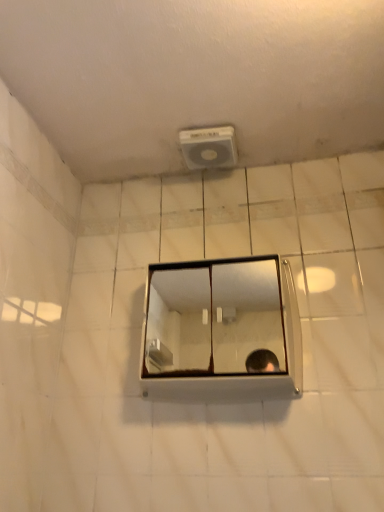
Find the location of a particular element. This screenshot has width=384, height=512. metallic rectangular mirror at center is located at coordinates (214, 319).

Describe the element at coordinates (214, 319) in the screenshot. Image resolution: width=384 pixels, height=512 pixels. I see `metallic rectangular mirror at center` at that location.

Locate an element on the screen. The image size is (384, 512). metallic rectangular mirror at center is located at coordinates (214, 319).